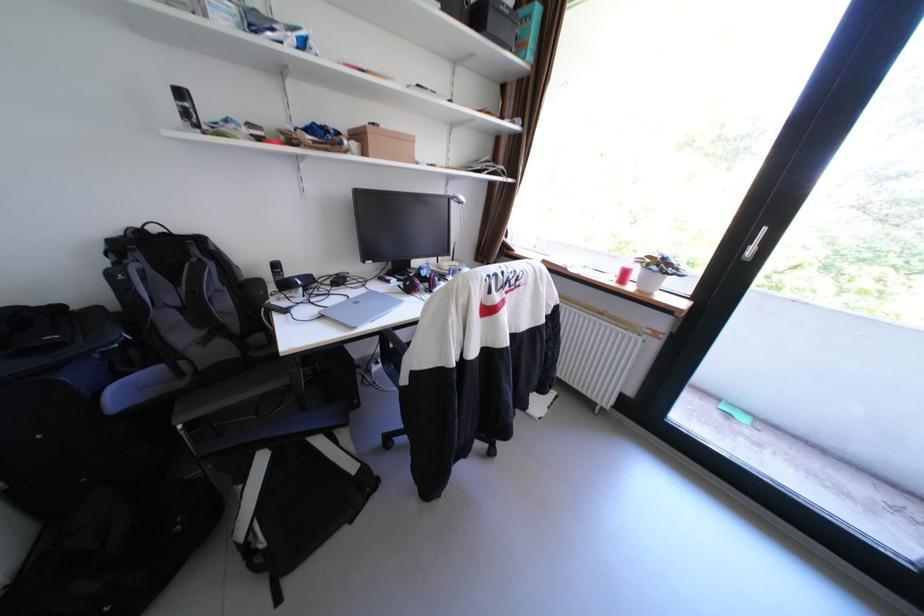
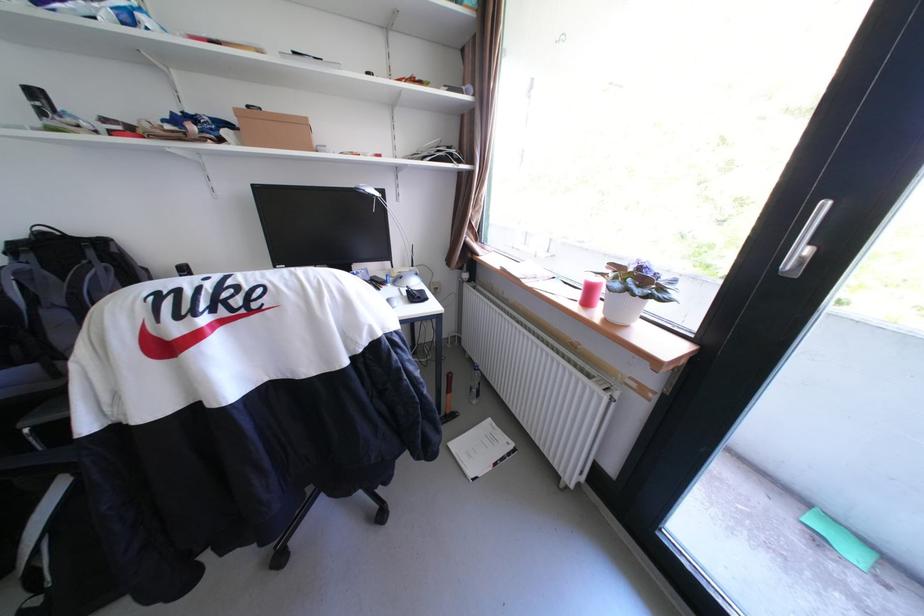
Locate, in the second image, the point that corresponds to the point at 755,419 in the first image.

(867, 554)